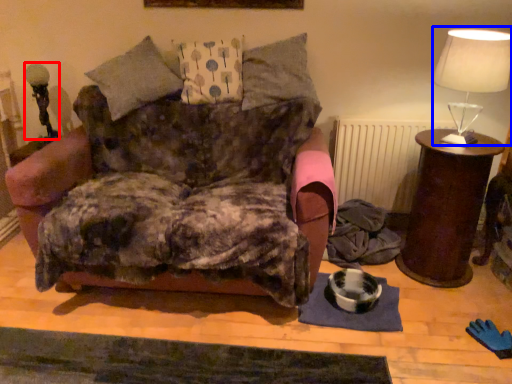
Question: Which object appears farthest to the camera in this image, table lamp (highlighted by a red box) or table lamp (highlighted by a blue box)?

Choices:
 (A) table lamp
 (B) table lamp

Answer: (A)